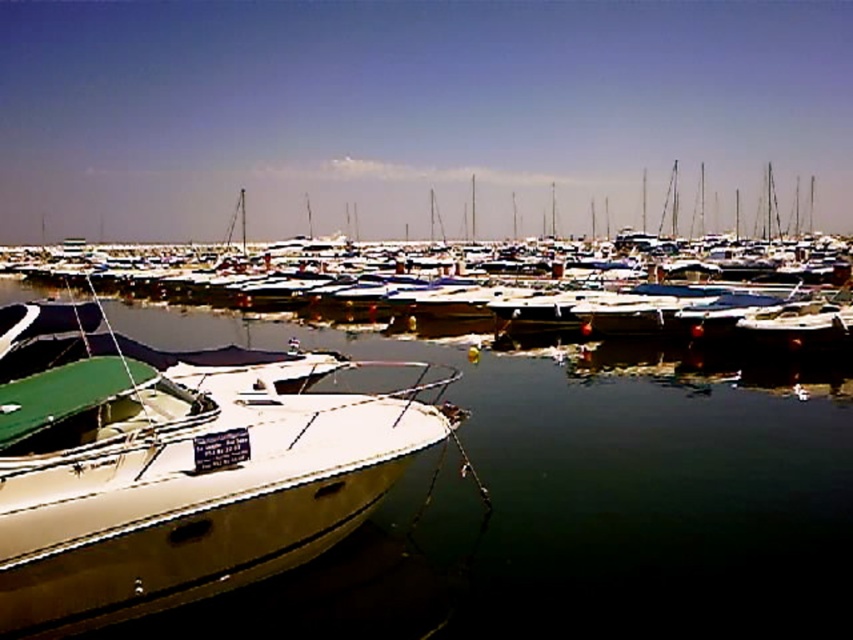
Question: Does clear water at boat front come behind white glossy boat at center?

Choices:
 (A) yes
 (B) no

Answer: (B)

Question: Which point appears farthest from the camera in this image?

Choices:
 (A) (636, 250)
 (B) (524, 493)

Answer: (A)

Question: Which object appears closest to the camera in this image?

Choices:
 (A) clear water at boat front
 (B) white glossy boat at center

Answer: (A)

Question: Where is clear water at boat front located in relation to white glossy boat at center in the image?

Choices:
 (A) right
 (B) left

Answer: (B)

Question: Can you confirm if clear water at boat front is positioned to the left of white glossy boat at center?

Choices:
 (A) no
 (B) yes

Answer: (B)